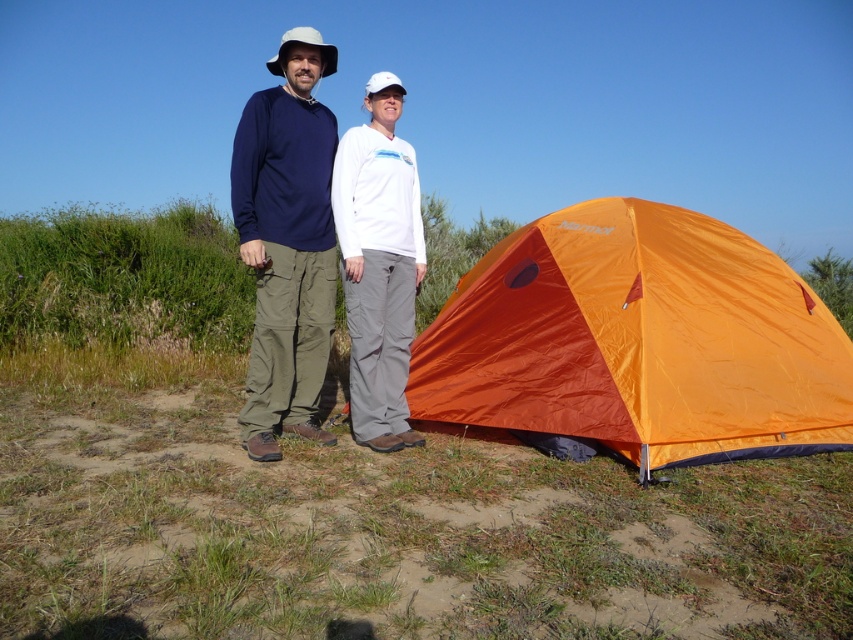
Question: Which of the following is the closest to the observer?

Choices:
 (A) (344, 244)
 (B) (613, 337)

Answer: (A)

Question: Which object is the closest to the matte blue shirt at center?

Choices:
 (A) orange nylon tent at lower right
 (B) white matte pants at center

Answer: (B)

Question: Does orange nylon tent at lower right come in front of matte blue shirt at center?

Choices:
 (A) no
 (B) yes

Answer: (B)

Question: Does orange nylon tent at lower right have a smaller size compared to white matte pants at center?

Choices:
 (A) yes
 (B) no

Answer: (B)

Question: Is matte blue shirt at center above white matte pants at center?

Choices:
 (A) no
 (B) yes

Answer: (B)

Question: Which object appears closest to the camera in this image?

Choices:
 (A) white matte pants at center
 (B) matte blue shirt at center

Answer: (B)